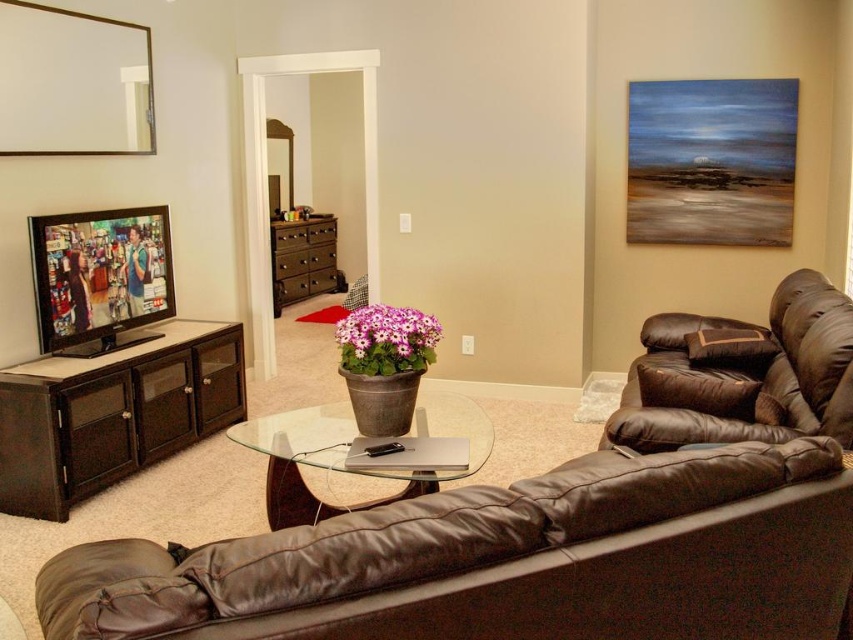
Question: Is brown leather couch at left thinner than brown leather armchair at right?

Choices:
 (A) no
 (B) yes

Answer: (A)

Question: Does oil painting at upper right appear under matte black television at left?

Choices:
 (A) yes
 (B) no

Answer: (B)

Question: Does brown leather couch at left appear under brown leather armchair at right?

Choices:
 (A) no
 (B) yes

Answer: (A)

Question: Based on their relative distances, which object is farther from the brown leather armchair at right?

Choices:
 (A) oil painting at upper right
 (B) dark brown wood entertainment center at left

Answer: (B)

Question: Among these points, which one is farthest from the camera?

Choices:
 (A) (349, 432)
 (B) (647, 225)
 (C) (596, 621)

Answer: (B)

Question: Which of the following is the farthest from the observer?

Choices:
 (A) (688, 168)
 (B) (70, 358)
 (C) (74, 221)
 (D) (648, 616)

Answer: (A)